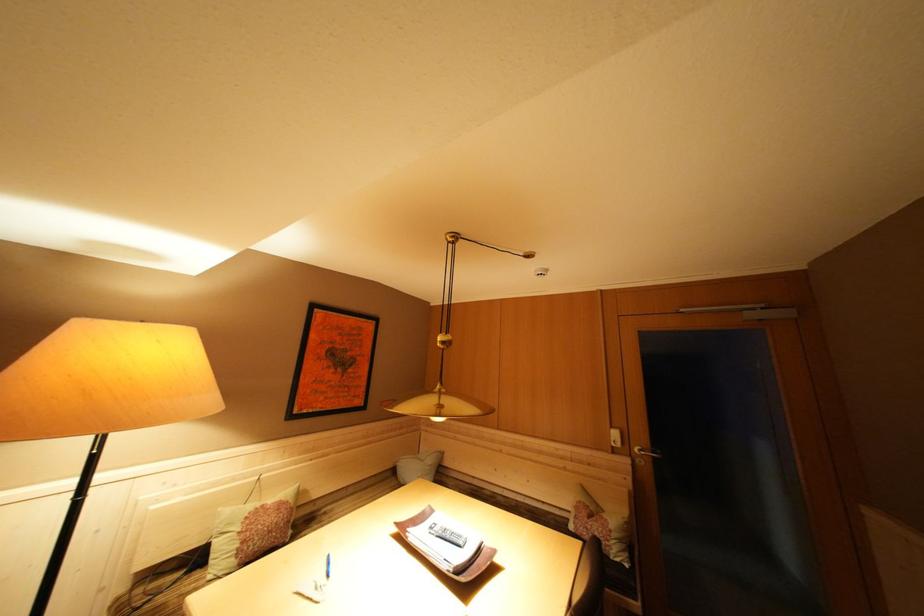
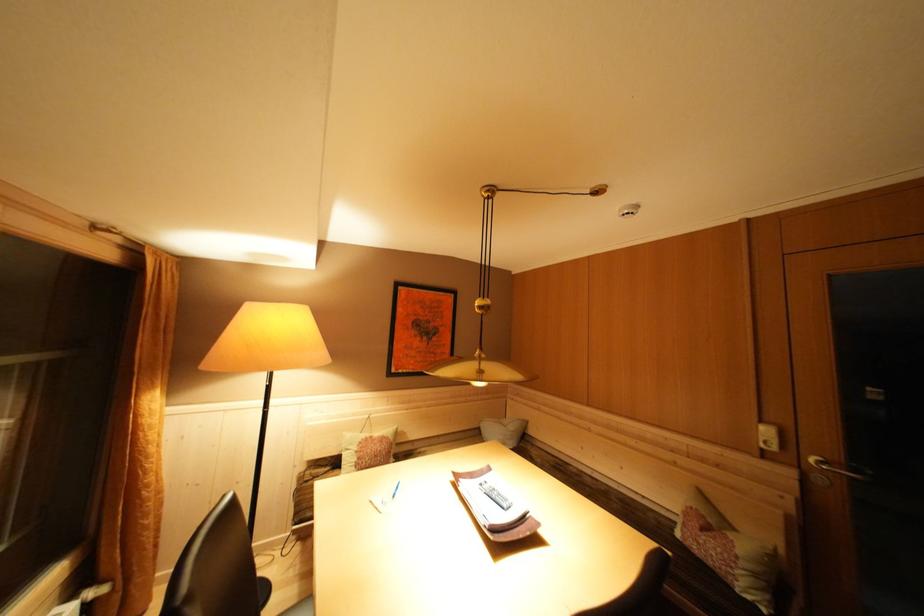
Find the pixel in the second image that matches point 618,532 in the first image.

(746, 557)